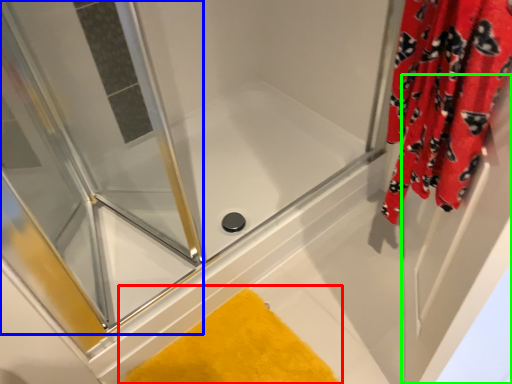
Question: Which object is the farthest from bath mat (highlighted by a red box)? Choose among these: screen door (highlighted by a blue box) or screen door (highlighted by a green box).

Choices:
 (A) screen door
 (B) screen door

Answer: (A)